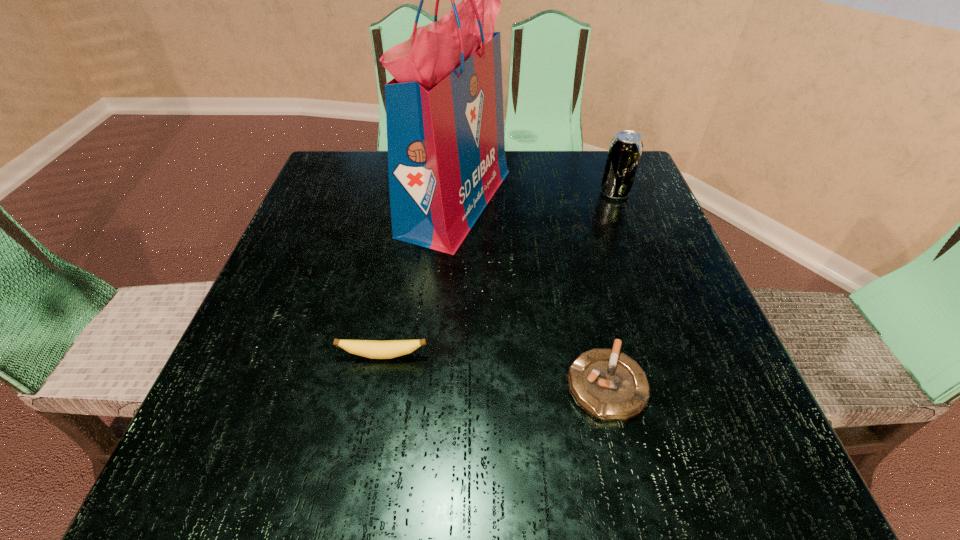
Find the location of a particular element. This screenshot has height=540, width=960. vacant point located between the soda can and the third object from left to right is located at coordinates (611, 289).

Identify which object is the second nearest to the rightmost object. Please provide its 2D coordinates. Your answer should be formatted as a tuple, i.e. [(x, y)], where the tuple contains the x and y coordinates of a point satisfying the conditions above.

[(610, 386)]

The height and width of the screenshot is (540, 960). In order to click on object that is the second closest one to the third object from left to right in this screenshot , I will do `click(444, 108)`.

Find the location of `vacant space that satisfies the following two spatial constraints: 1. on the front-facing side of the grocery bag; 2. on the right side of the third object from left to right`. vacant space that satisfies the following two spatial constraints: 1. on the front-facing side of the grocery bag; 2. on the right side of the third object from left to right is located at coordinates (444, 384).

Where is `blank space that satisfies the following two spatial constraints: 1. on the front side of the third tallest object; 2. on the left side of the shortest object`? This screenshot has width=960, height=540. blank space that satisfies the following two spatial constraints: 1. on the front side of the third tallest object; 2. on the left side of the shortest object is located at coordinates (377, 384).

Find the location of a particular element. free point that satisfies the following two spatial constraints: 1. on the front-facing side of the third object from left to right; 2. on the left side of the tallest object is located at coordinates (444, 384).

Image resolution: width=960 pixels, height=540 pixels. In order to click on vacant point that satisfies the following two spatial constraints: 1. on the front-facing side of the grocery bag; 2. on the left side of the third object from left to right in this screenshot , I will do `click(444, 384)`.

Find the location of a particular element. The width and height of the screenshot is (960, 540). free spot that satisfies the following two spatial constraints: 1. on the front-facing side of the grocery bag; 2. on the back side of the shortest object is located at coordinates (444, 384).